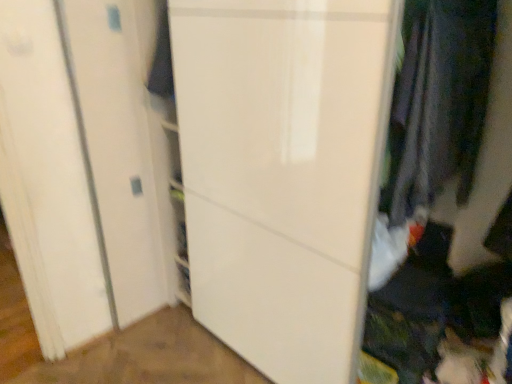
Question: Does white glossy door at center contain dark gray fabric at right?

Choices:
 (A) no
 (B) yes

Answer: (B)

Question: From the image's perspective, would you say white glossy door at center is positioned over dark gray fabric at right?

Choices:
 (A) no
 (B) yes

Answer: (A)

Question: Is white glossy door at center closer to the viewer compared to dark gray fabric at right?

Choices:
 (A) yes
 (B) no

Answer: (A)

Question: Is white glossy door at center to the right of dark gray fabric at right from the viewer's perspective?

Choices:
 (A) yes
 (B) no

Answer: (B)

Question: Is white glossy door at center not close to dark gray fabric at right?

Choices:
 (A) no
 (B) yes

Answer: (A)

Question: From the image's perspective, is white glossy door at center beneath dark gray fabric at right?

Choices:
 (A) no
 (B) yes

Answer: (B)

Question: From the image's perspective, is dark gray fabric at right below white glossy door at center?

Choices:
 (A) yes
 (B) no

Answer: (B)

Question: Considering the relative sizes of dark gray fabric at right and white glossy door at center in the image provided, is dark gray fabric at right smaller than white glossy door at center?

Choices:
 (A) no
 (B) yes

Answer: (B)

Question: Is dark gray fabric at right far away from white glossy door at center?

Choices:
 (A) no
 (B) yes

Answer: (A)

Question: From the image's perspective, is dark gray fabric at right on white glossy door at center?

Choices:
 (A) yes
 (B) no

Answer: (A)

Question: Does dark gray fabric at right appear on the left side of white glossy door at center?

Choices:
 (A) no
 (B) yes

Answer: (A)

Question: From a real-world perspective, is dark gray fabric at right on top of white glossy door at center?

Choices:
 (A) no
 (B) yes

Answer: (B)

Question: From a real-world perspective, is dark gray fabric at right above or below white glossy door at center?

Choices:
 (A) above
 (B) below

Answer: (A)